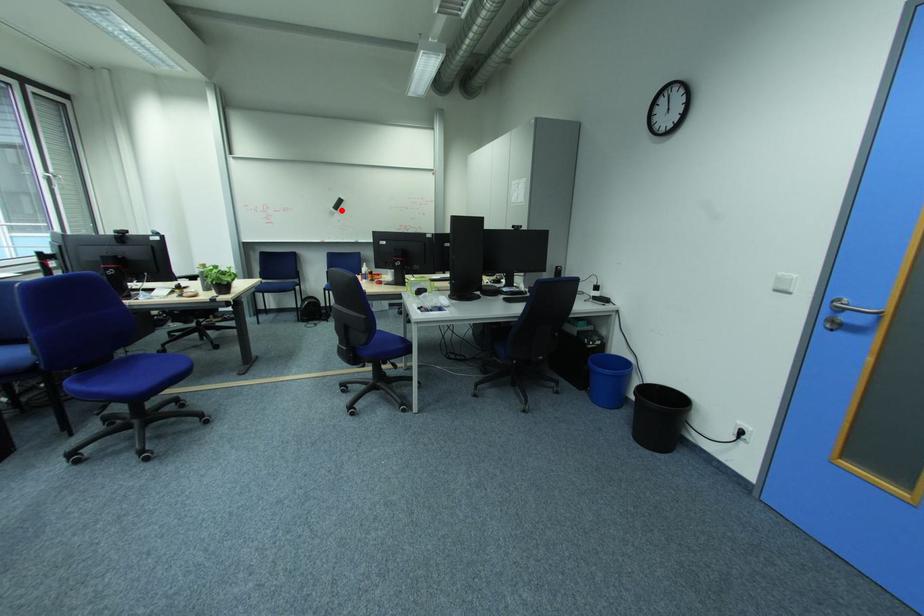
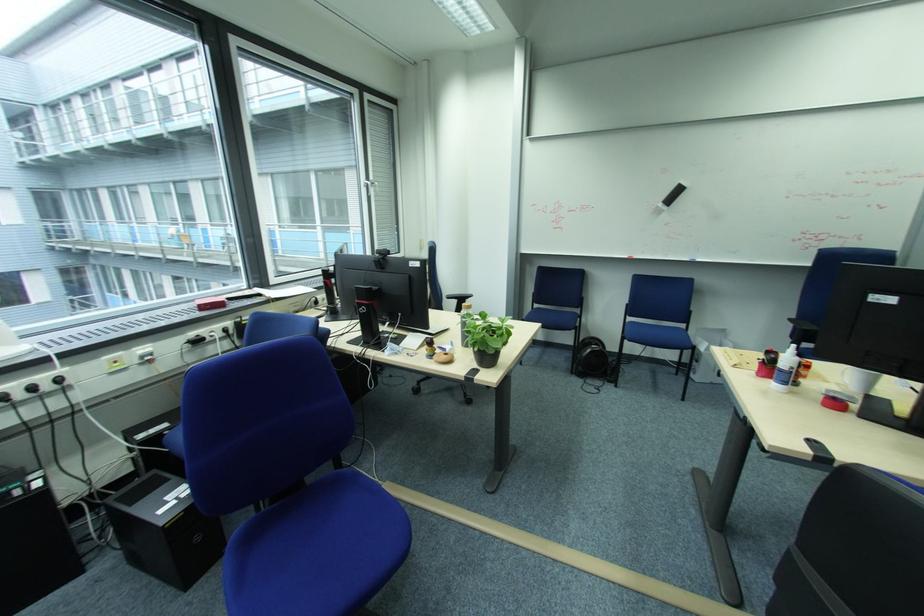
Where in the second image is the point corresponding to the highlighted location from the first image?

(669, 206)